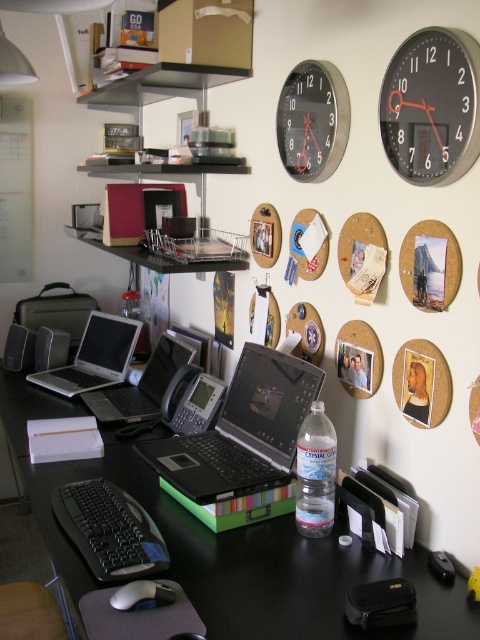
You are setting up a new monitor on your desk and need to know the position of the black metallic clock at upper right relative to the black plastic laptop at center. Which side of the laptop is the clock located on?

The black metallic clock at upper right is located to the right of the black plastic laptop at center.

You are an office worker who needs to check the time quickly. You see two black metallic clocks on the wall above your desk. Which one is positioned lower between the black metallic clock at upper right and the black metallic clock at upper center?

The black metallic clock at upper right is positioned lower than the black metallic clock at upper center.